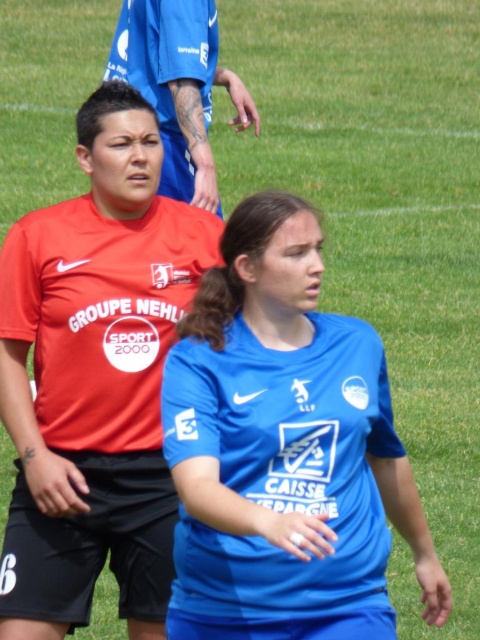
Does matte red shirt at left appear on the left side of matte blue jersey at upper center?

Yes, matte red shirt at left is to the left of matte blue jersey at upper center.

Who is positioned more to the left, matte red shirt at left or matte blue jersey at upper center?

From the viewer's perspective, matte red shirt at left appears more on the left side.

Find the location of a particular element. The height and width of the screenshot is (640, 480). matte red shirt at left is located at coordinates (95, 378).

Which is more to the right, blue jersey at center or matte red shirt at left?

From the viewer's perspective, blue jersey at center appears more on the right side.

Based on the photo, does blue jersey at center have a greater height compared to matte red shirt at left?

Incorrect, blue jersey at center's height is not larger of matte red shirt at left's.

Is point (257, 326) behind point (111, 257)?

No, (257, 326) is closer to viewer.

You are a GUI agent. You are given a task and a screenshot of the screen. Output one action in this format:
    pyautogui.click(x=<x>, y=<y>)
    Task: Click on the blue jersey at center
    This screenshot has width=480, height=640.
    Given the screenshot: What is the action you would take?
    pyautogui.click(x=283, y=445)

Does blue jersey at center appear under matte blue jersey at upper center?

Correct, blue jersey at center is located below matte blue jersey at upper center.

Is blue jersey at center to the right of matte blue jersey at upper center from the viewer's perspective?

Yes, blue jersey at center is to the right of matte blue jersey at upper center.

Does point (392, 625) lie behind point (191, 173)?

No.

Locate an element on the screen. blue jersey at center is located at coordinates (283, 445).